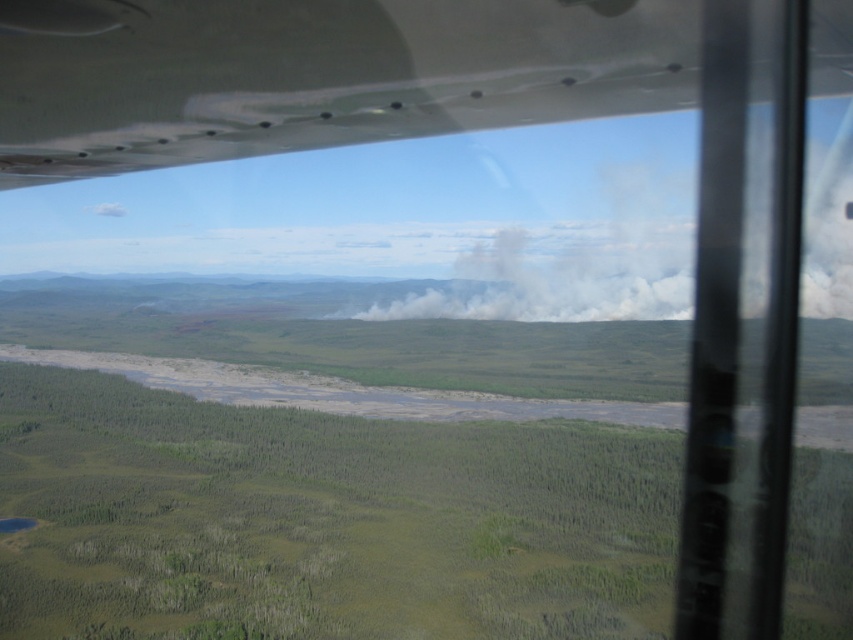
Does smooth white wing at upper left lie behind white smoke at center?

No, smooth white wing at upper left is in front of white smoke at center.

Describe the element at coordinates (316, 74) in the screenshot. The width and height of the screenshot is (853, 640). I see `smooth white wing at upper left` at that location.

What are the coordinates of `smooth white wing at upper left` in the screenshot? It's located at (316, 74).